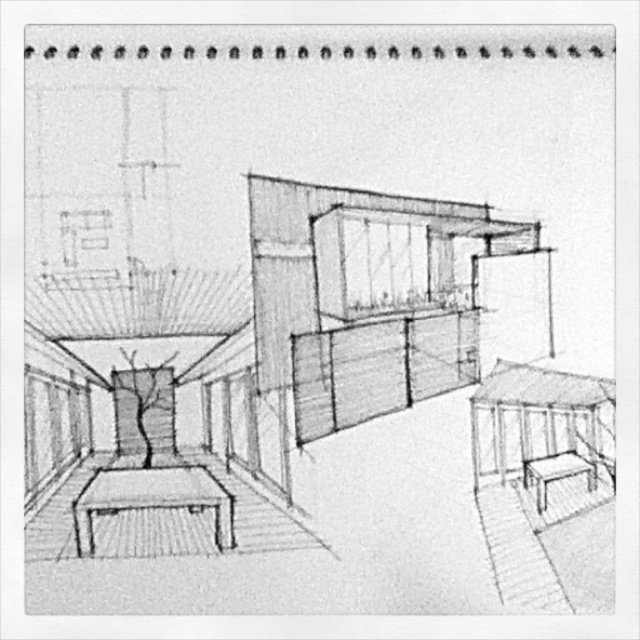
You are standing in the modern architectural design depicted in the image. You need to place a vase on the smooth wooden table at lower left and a cushion on the matte wood stool at lower right. According to the spatial arrangement, which object is positioned to the left side of the other?

The smooth wooden table at lower left is positioned to the left of the matte wood stool at lower right.

You are an architect reviewing a design sketch. You notice two points marked in the image at coordinates point(177,492) and point(577,465). From your vantage point, which of these points appears closer to you in the perspective drawing?

Point(577,465) is closer to you because in the perspective drawing, point(177,492) is positioned behind point(577,465).

You are standing in the scene depicted in the image. You want to place a 1.2 meter long rectangular object on the smooth wooden table at lower left. Can you fit it diagonally on the table?

The smooth wooden table at lower left and viewer are 1.50 meters apart from each other, but the table dimensions are not provided. Without knowing the table size, it is impossible to determine if the object will fit diagonally.